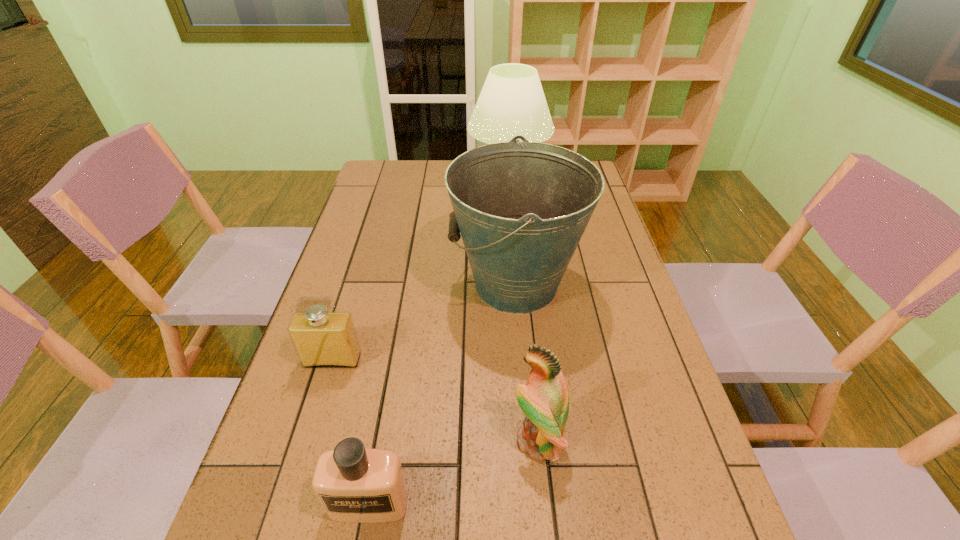
Identify the location of free location located 0.270m on the shade of the lampshade. This screenshot has height=540, width=960. [396, 180].

Identify the location of vacant space located 0.240m with the handle on opposite sides of the bucket. This screenshot has height=540, width=960. (365, 285).

Image resolution: width=960 pixels, height=540 pixels. In order to click on free space located 0.260m with the handle on opposite sides of the bucket in this screenshot , I will do `click(357, 285)`.

Where is `vacant space located with the handle on opposite sides of the bucket`? This screenshot has width=960, height=540. vacant space located with the handle on opposite sides of the bucket is located at coordinates (433, 285).

The width and height of the screenshot is (960, 540). Identify the location of free location located on the front-facing side of the second nearest object. (428, 440).

Identify the location of vacant space located on the front-facing side of the second nearest object. The image size is (960, 540). (343, 440).

Locate an element on the screen. This screenshot has height=540, width=960. free point located on the front-facing side of the second nearest object is located at coordinates (458, 440).

You are a GUI agent. You are given a task and a screenshot of the screen. Output one action in this format:
    pyautogui.click(x=<x>, y=<y>)
    Task: Click on the vacant space located 0.050m on the front-facing side of the third farthest object
    
    Given the screenshot: What is the action you would take?
    pyautogui.click(x=324, y=388)

The height and width of the screenshot is (540, 960). I want to click on object positioned at the far edge, so click(512, 102).

This screenshot has height=540, width=960. In order to click on object that is at the right edge in this screenshot , I will do click(522, 207).